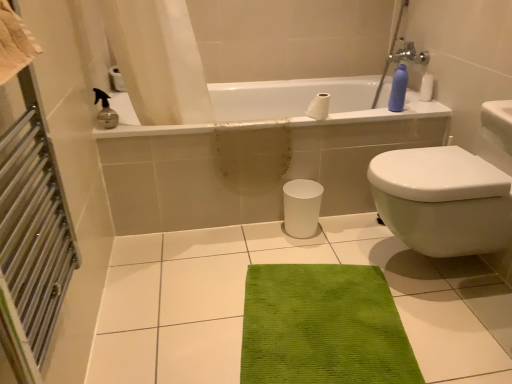
Question: Is green textured mat at center not within brushed metal radiator at left?

Choices:
 (A) yes
 (B) no

Answer: (A)

Question: From the image's perspective, is green textured mat at center below brushed metal radiator at left?

Choices:
 (A) yes
 (B) no

Answer: (A)

Question: Does green textured mat at center appear on the left side of brushed metal radiator at left?

Choices:
 (A) yes
 (B) no

Answer: (B)

Question: Does green textured mat at center have a lesser width compared to brushed metal radiator at left?

Choices:
 (A) yes
 (B) no

Answer: (B)

Question: Considering the relative positions of green textured mat at center and brushed metal radiator at left in the image provided, is green textured mat at center behind brushed metal radiator at left?

Choices:
 (A) no
 (B) yes

Answer: (B)

Question: Are green textured mat at center and brushed metal radiator at left beside each other?

Choices:
 (A) yes
 (B) no

Answer: (B)

Question: Does white glossy bathtub at upper center have a lesser width compared to white matte toilet paper at upper center?

Choices:
 (A) no
 (B) yes

Answer: (A)

Question: Can you see white glossy bathtub at upper center touching white matte toilet paper at upper center?

Choices:
 (A) yes
 (B) no

Answer: (B)

Question: Can we say white glossy bathtub at upper center lies outside white matte toilet paper at upper center?

Choices:
 (A) yes
 (B) no

Answer: (A)

Question: Does white glossy bathtub at upper center have a lesser height compared to white matte toilet paper at upper center?

Choices:
 (A) yes
 (B) no

Answer: (B)

Question: Considering the relative sizes of white glossy bathtub at upper center and white matte toilet paper at upper center in the image provided, is white glossy bathtub at upper center wider than white matte toilet paper at upper center?

Choices:
 (A) yes
 (B) no

Answer: (A)

Question: Considering the relative positions of white glossy bathtub at upper center and white matte toilet paper at upper center in the image provided, is white glossy bathtub at upper center to the left of white matte toilet paper at upper center from the viewer's perspective?

Choices:
 (A) yes
 (B) no

Answer: (A)

Question: Is white matte toilet paper at upper center to the left of beige cotton towel at left from the viewer's perspective?

Choices:
 (A) no
 (B) yes

Answer: (A)